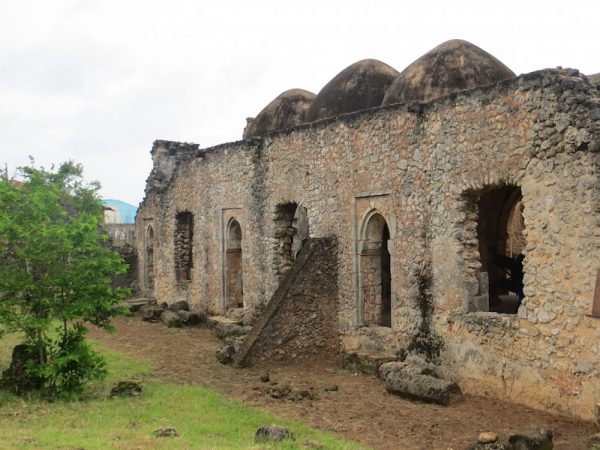
Locate an element on the screen. Image resolution: width=600 pixels, height=450 pixels. archways is located at coordinates (375, 215), (232, 217), (150, 226).